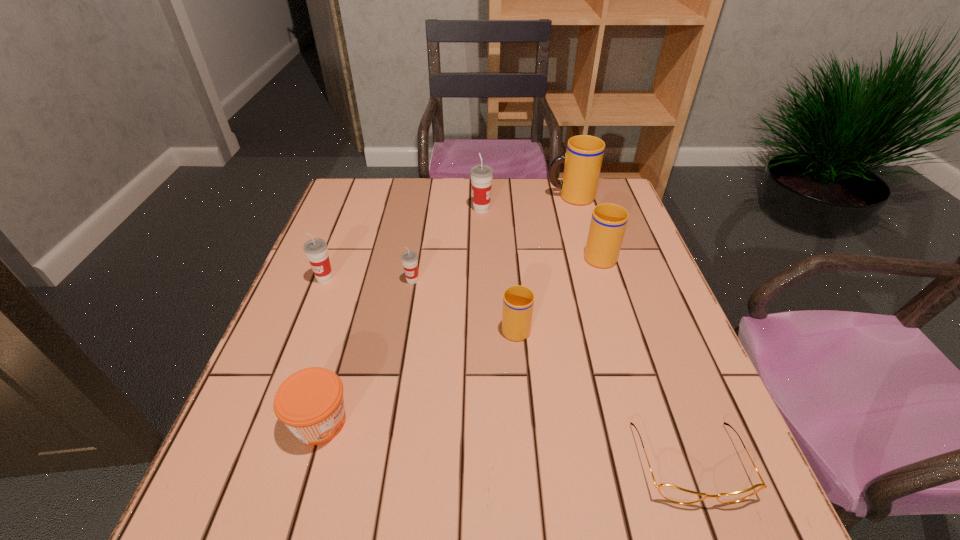
Identify the location of the second red cup from left to right. This screenshot has width=960, height=540. (409, 258).

Where is `the seventh object from right to left`? the seventh object from right to left is located at coordinates (310, 402).

I want to click on spectacles, so click(x=672, y=493).

Where is `the shortest object`? The width and height of the screenshot is (960, 540). the shortest object is located at coordinates (672, 493).

Where is `vacant space located 0.230m on the side of the biggest beige cup with the handle`? vacant space located 0.230m on the side of the biggest beige cup with the handle is located at coordinates (472, 197).

In order to click on blank area located on the side of the biggest beige cup with the handle in this screenshot , I will do `click(523, 197)`.

I want to click on free space located on the side of the biggest beige cup with the handle, so click(446, 197).

Find the location of `vacant space located on the side of the biggest red cup with the logo`. vacant space located on the side of the biggest red cup with the logo is located at coordinates (424, 209).

The height and width of the screenshot is (540, 960). I want to click on vacant space located 0.050m on the side of the biggest red cup with the logo, so click(x=454, y=209).

The height and width of the screenshot is (540, 960). What are the coordinates of `vacant space located 0.250m on the side of the biggest red cup with the logo` in the screenshot? It's located at (388, 209).